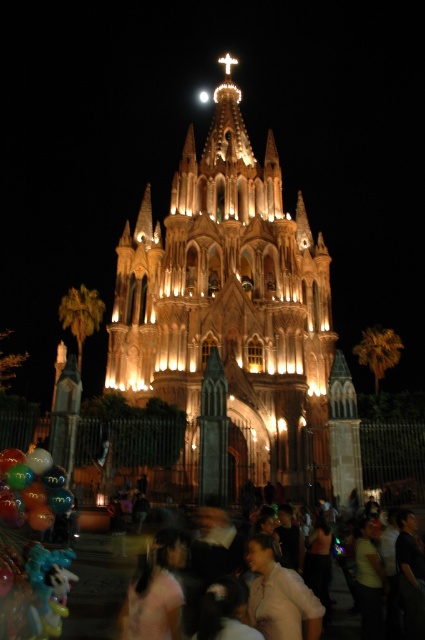
You are an event planner setting up decorations for a festival at the cathedral. You have a large banner that needs to be hung between the illuminated stone tower at center and the light pink fabric at center. Based on their widths, can the banner fit horizontally between them without needing to be trimmed?

The illuminated stone tower at center might be wider than light pink fabric at center, so there is uncertainty about whether the banner can fit without trimming. It would be best to measure the space between them first.

You are at the cathedral and want to take a photo of the blurred people at lower center without the light pink fabric at center appearing in the shot. How should you adjust your camera position?

Move your camera to the right so that the light pink fabric at center is no longer in the frame with the blurred people at lower center.